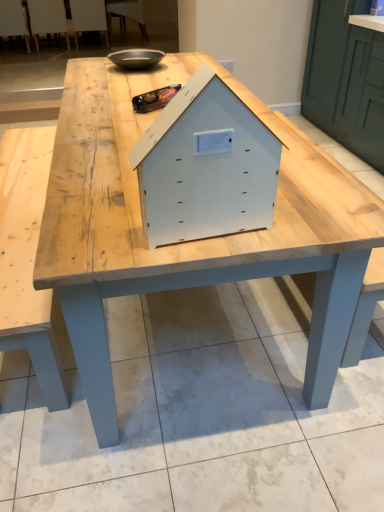
Where is `free space that is to the left of matte black bowl at upper center`? free space that is to the left of matte black bowl at upper center is located at coordinates (85, 70).